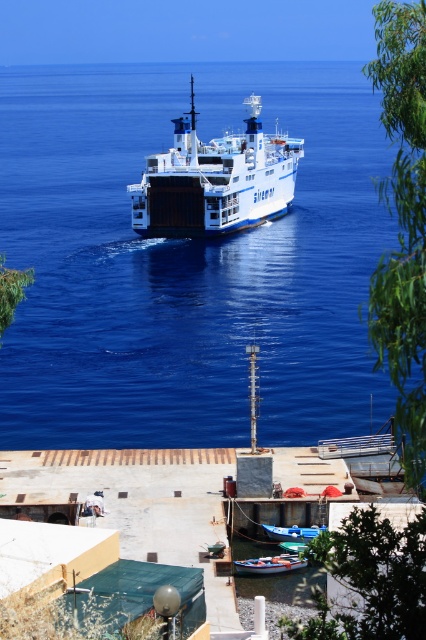
Question: Which point appears farthest from the camera in this image?

Choices:
 (A) (244, 564)
 (B) (299, 531)

Answer: (B)

Question: Among these points, which one is nearest to the camera?

Choices:
 (A) (255, 140)
 (B) (290, 536)

Answer: (B)

Question: Is the position of wooden boat at lower center more distant than that of blue matte boat at lower center?

Choices:
 (A) yes
 (B) no

Answer: (B)

Question: Which point is closer to the camera taking this photo?

Choices:
 (A) (138, 198)
 (B) (37, 256)
 (C) (290, 570)
 (D) (287, 536)

Answer: (C)

Question: Does blue liquid water at center have a larger size compared to white matte ferry at center?

Choices:
 (A) yes
 (B) no

Answer: (A)

Question: Can you confirm if blue liquid water at center is positioned below wooden boat at lower center?

Choices:
 (A) yes
 (B) no

Answer: (B)